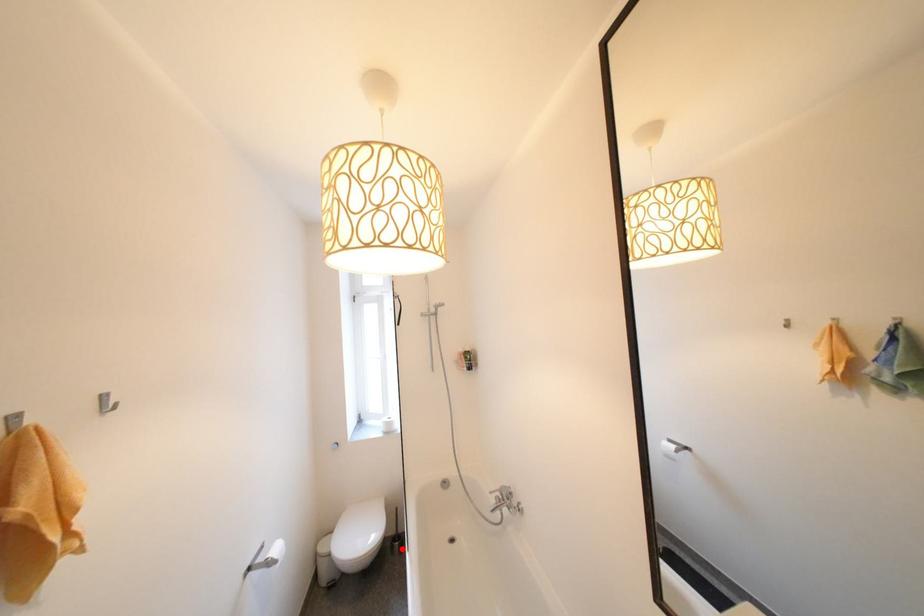
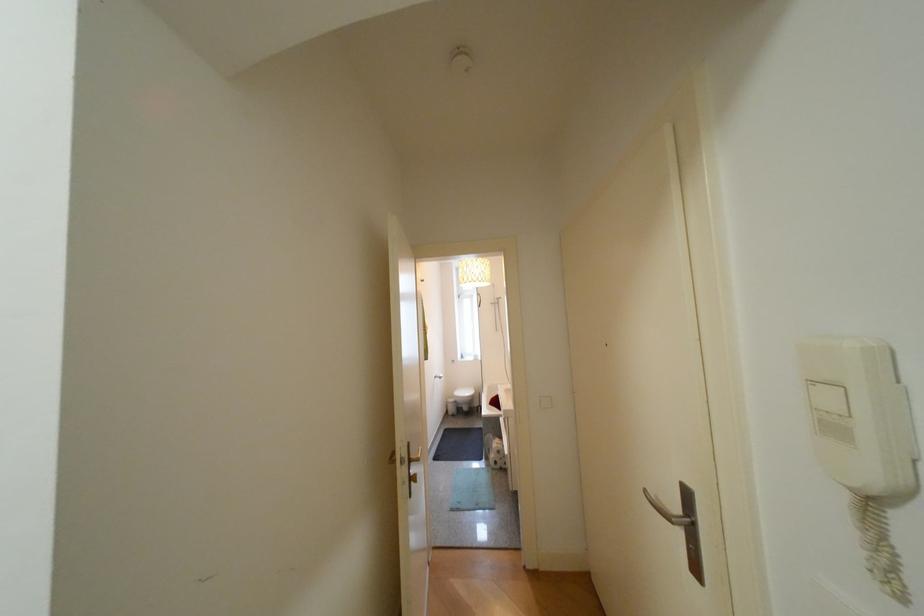
Question: I am providing you with two images of the same scene from different viewpoints. A red point is marked on the first image. At the location where the point appears in image 1, is it still visible in image 2?

Choices:
 (A) Yes
 (B) No

Answer: (B)